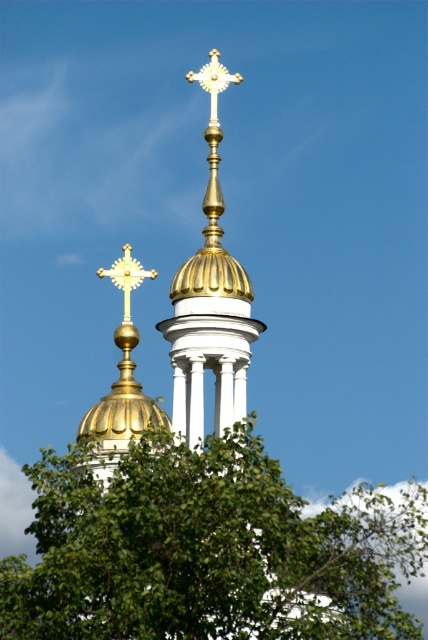
Question: Which object is the closest to the green leafy tree at center?

Choices:
 (A) gold polished metal cross at upper center
 (B) gold metallic cross at upper center

Answer: (B)

Question: Does green leafy tree at center appear under gold metallic cross at upper center?

Choices:
 (A) no
 (B) yes

Answer: (B)

Question: Which of the following is the closest to the observer?

Choices:
 (A) gold metallic cross at upper center
 (B) gold polished metal cross at upper center
 (C) green leafy tree at center

Answer: (C)

Question: Estimate the real-world distances between objects in this image. Which object is farther from the green leafy tree at center?

Choices:
 (A) gold polished metal cross at upper center
 (B) gold metallic cross at upper center

Answer: (A)

Question: From the image, what is the correct spatial relationship of gold metallic cross at upper center in relation to gold polished metal cross at upper center?

Choices:
 (A) right
 (B) left

Answer: (B)

Question: Does green leafy tree at center have a larger size compared to gold polished metal cross at upper center?

Choices:
 (A) yes
 (B) no

Answer: (A)